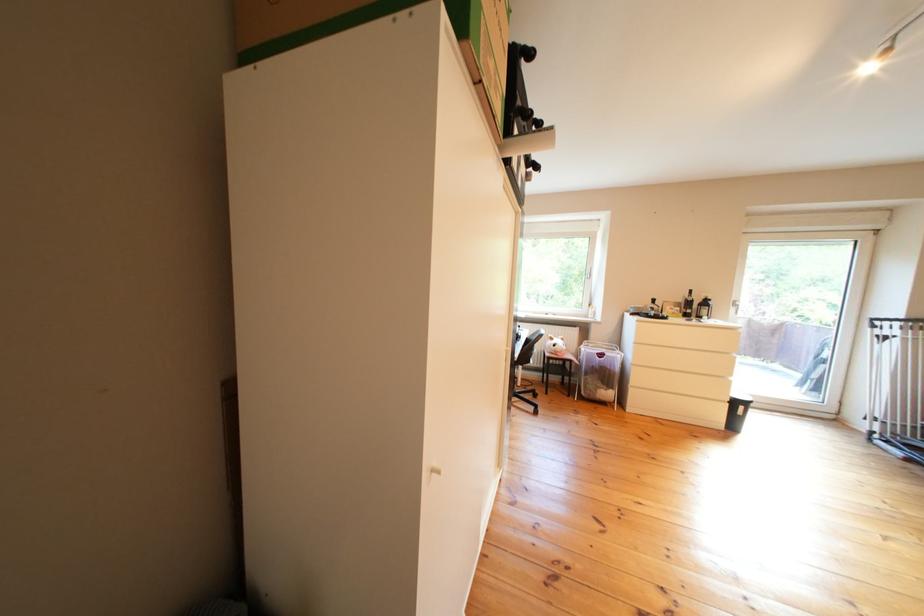
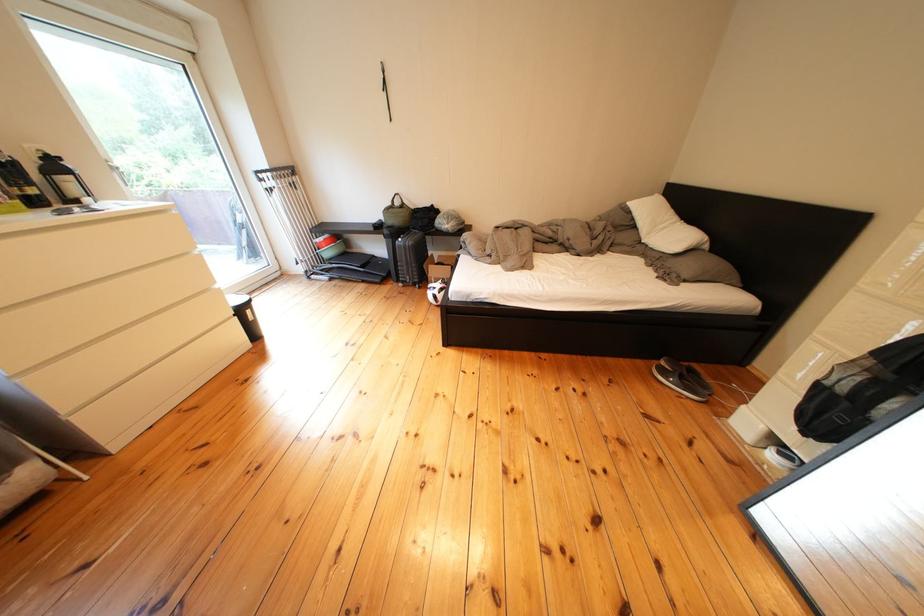
Find the pixel in the second image that matches (x=736, y=382) in the first image.

(220, 294)